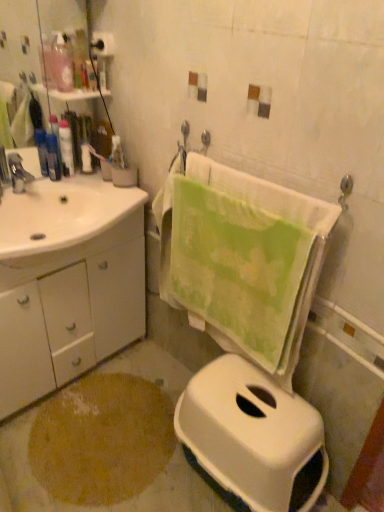
Locate an element on the screen. This screenshot has width=384, height=512. vacant space in front of matte black lotion at left, the 2th toiletry positioned from the top is located at coordinates (51, 196).